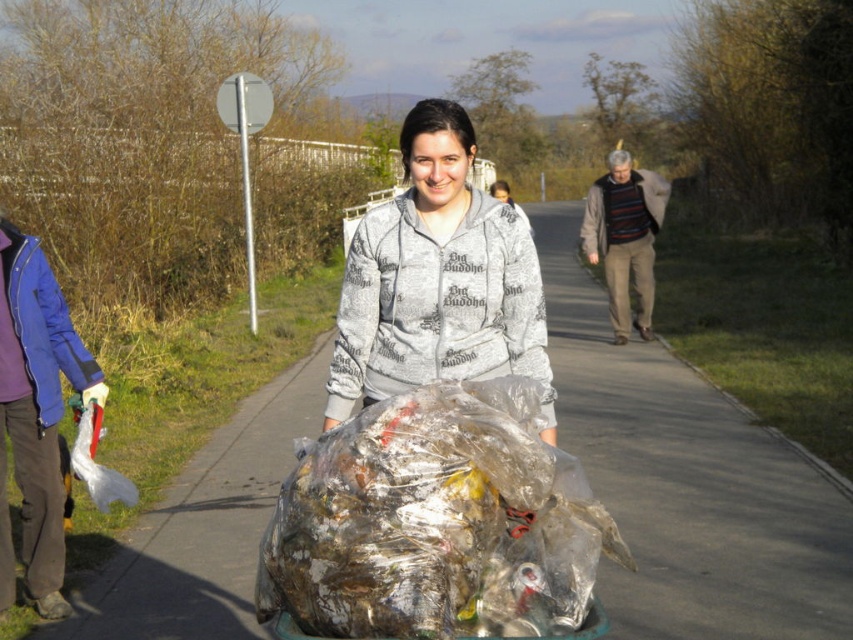
You are a delivery person trying to navigate a narrow path. You see the clear asphalt pavement at center and the translucent plastic bag at center. Which path is wider for your delivery cart?

The clear asphalt pavement at center is wider than the translucent plastic bag at center, so the delivery cart can fit through the clear asphalt pavement at center.

You are a photographer trying to capture the gray printed hoodie at center and the translucent plastic bag at center in the same frame. Since you want the hoodie to be on the right side of your photo, should you move to your left or right?

The translucent plastic bag at center is to the left of gray printed hoodie at center. To have the gray printed hoodie at center on the right side of the photo, you should move to your left so that the hoodie shifts to the right in your frame.

You are a delivery person trying to place a large cardboard box on the clear asphalt pavement at center. Will the translucent plastic bag at center interfere with placing the box?

The clear asphalt pavement at center is bigger than the translucent plastic bag at center, so there should be enough space to place the cardboard box without interference from the translucent plastic bag at center.